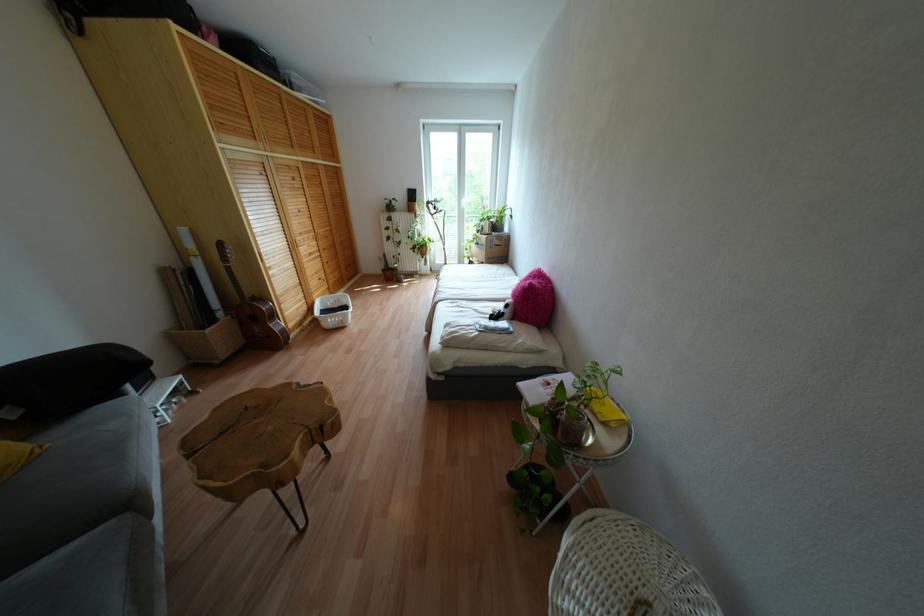
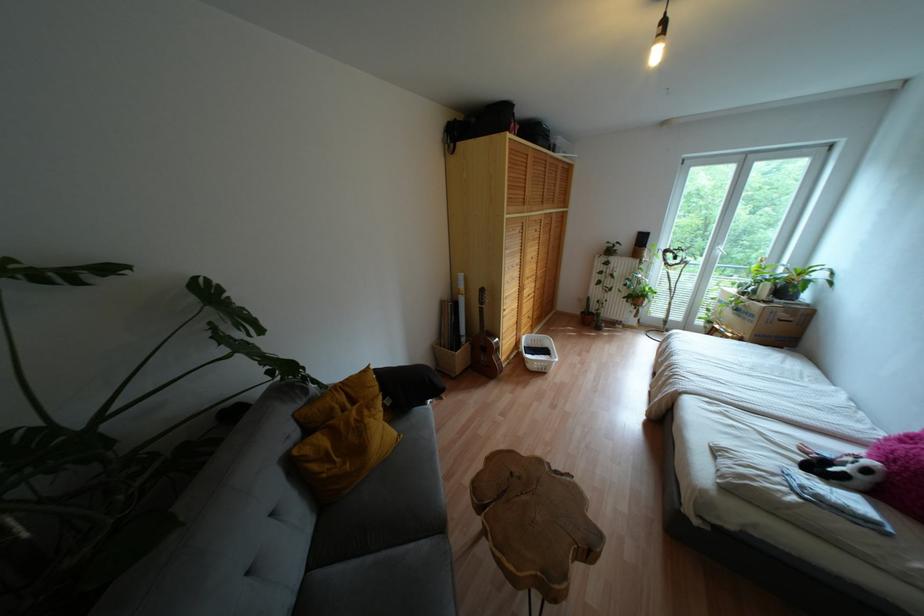
In the second image, find the point that corresponds to [220,244] in the first image.

(481, 290)